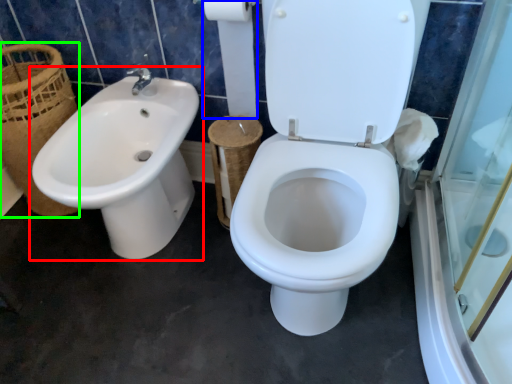
Question: Which object is positioned closest to sink (highlighted by a red box)? Select from toilet paper (highlighted by a blue box) and basket (highlighted by a green box).

Choices:
 (A) toilet paper
 (B) basket

Answer: (B)